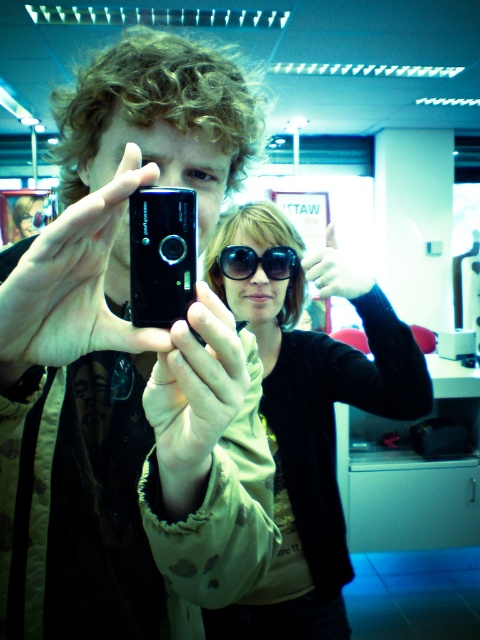
Question: Does matte black phone at center have a smaller size compared to black plastic camera at center?

Choices:
 (A) no
 (B) yes

Answer: (A)

Question: Can you confirm if sunglasses at center is positioned to the left of black matte phone at center?

Choices:
 (A) yes
 (B) no

Answer: (B)

Question: Which point is closer to the camera?

Choices:
 (A) (269, 285)
 (B) (7, 301)
 (C) (142, 216)

Answer: (B)

Question: Does matte black phone at center lie behind matte black hand at center?

Choices:
 (A) no
 (B) yes

Answer: (A)

Question: Which object is farther from the camera taking this photo?

Choices:
 (A) black matte camera at center
 (B) matte black hand at center
 (C) black plastic camera at center
 (D) matte black phone at center

Answer: (B)

Question: Which point is closer to the camera taking this photo?

Choices:
 (A) (134, 250)
 (B) (210, 268)
 (C) (229, 248)
 (D) (339, 260)

Answer: (A)